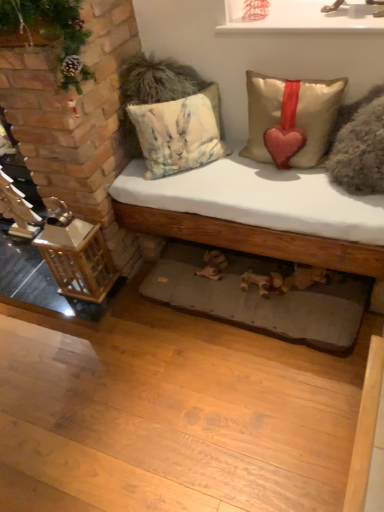
Find the location of `vacant region in front of satin gold pillow with red heart at upper center, the second pillow from the right`. vacant region in front of satin gold pillow with red heart at upper center, the second pillow from the right is located at coordinates (294, 200).